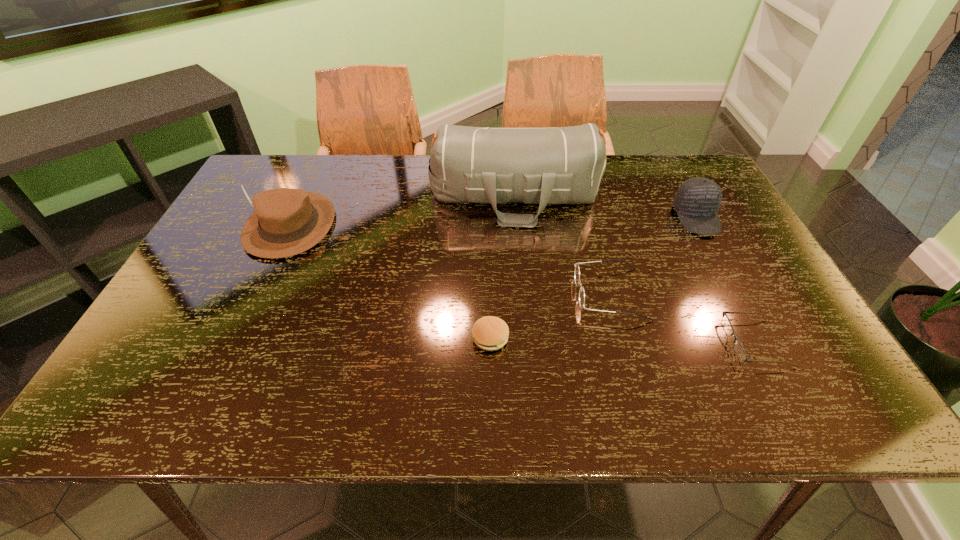
Where is `duffel bag`? The width and height of the screenshot is (960, 540). duffel bag is located at coordinates (552, 165).

Identify the location of the fifth shortest object. The image size is (960, 540). (285, 222).

At what (x,y) coordinates should I click in order to perform the action: click on the leftmost object. Please return your answer as a coordinate pair (x, y). Looking at the image, I should click on coord(285,222).

Image resolution: width=960 pixels, height=540 pixels. What are the coordinates of `the fourth shortest object` in the screenshot? It's located at (697, 201).

Locate an element on the screen. The width and height of the screenshot is (960, 540). the left spectacles is located at coordinates (577, 271).

In order to click on the third shortest object in this screenshot , I will do `click(577, 271)`.

The width and height of the screenshot is (960, 540). Find the location of `the second shortest object`. the second shortest object is located at coordinates (489, 333).

Locate an element on the screen. the right spectacles is located at coordinates (739, 350).

Find the location of a particular element. The width and height of the screenshot is (960, 540). the shortest object is located at coordinates (739, 350).

Locate an element on the screen. vacant area situated on the left of the duffel bag is located at coordinates (371, 196).